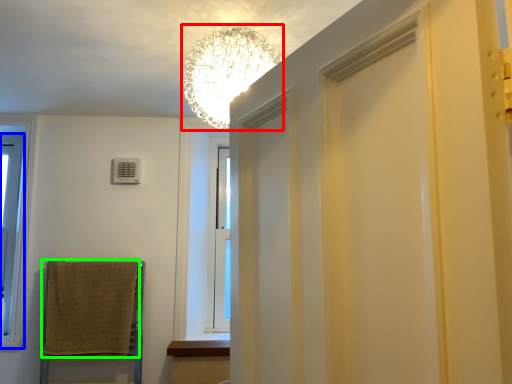
Question: Estimate the real-world distances between objects in this image. Which object is closer to lamp (highlighted by a red box), window (highlighted by a blue box) or bath towel (highlighted by a green box)?

Choices:
 (A) window
 (B) bath towel

Answer: (B)